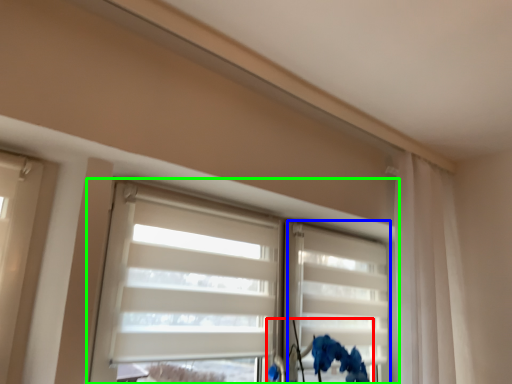
Question: Which object is the farthest from floral arrangement (highlighted by a red box)? Choose among these: shutter (highlighted by a blue box) or window (highlighted by a green box).

Choices:
 (A) shutter
 (B) window

Answer: (B)